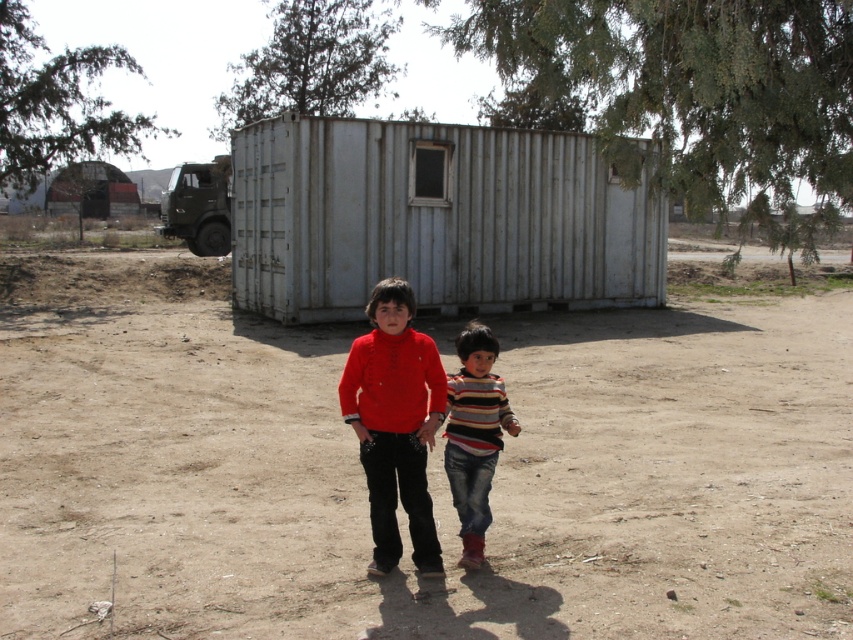
Question: Which object appears farthest from the camera in this image?

Choices:
 (A) matte red shirt at center
 (B) striped fabric shirt at center
 (C) brown sandy dirt at center
 (D) rustic corrugated metal hut at upper center

Answer: (D)

Question: Observing the image, what is the correct spatial positioning of brown sandy dirt at center in reference to striped fabric shirt at center?

Choices:
 (A) above
 (B) below

Answer: (A)

Question: Which point appears farthest from the camera in this image?

Choices:
 (A) (387, 468)
 (B) (273, 134)
 (C) (463, 516)

Answer: (B)

Question: Where is white corrugated metal container at center located in relation to striped fabric shirt at center in the image?

Choices:
 (A) left
 (B) right

Answer: (A)

Question: Is brown sandy dirt at center positioned before rustic corrugated metal hut at upper center?

Choices:
 (A) no
 (B) yes

Answer: (B)

Question: Which point is closer to the camera?

Choices:
 (A) (485, 332)
 (B) (518, 314)
 (C) (312, 301)
 (D) (91, 212)

Answer: (A)